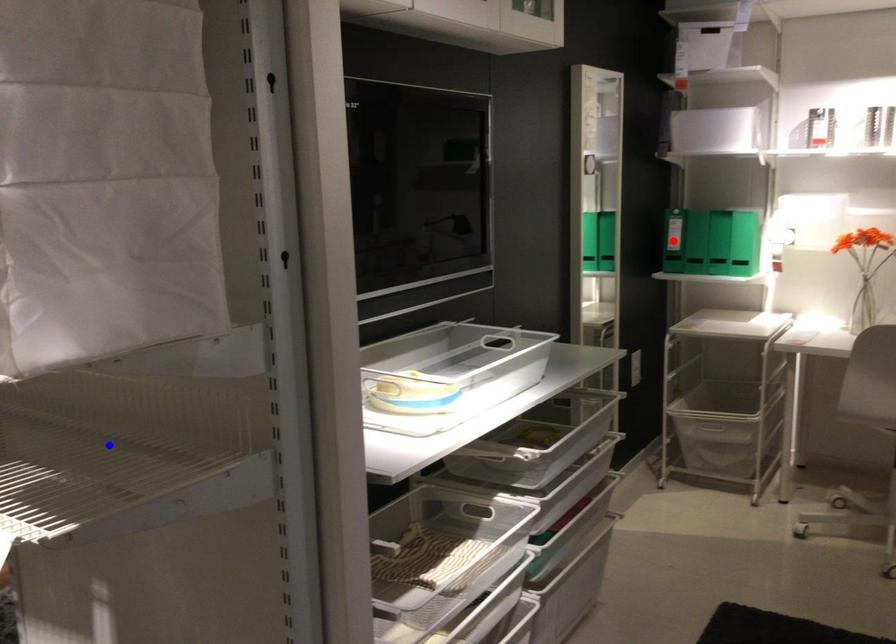
Question: Two points are marked on the image. Which point is closer to the camera?

Choices:
 (A) Blue point is closer.
 (B) Red point is closer.

Answer: (A)